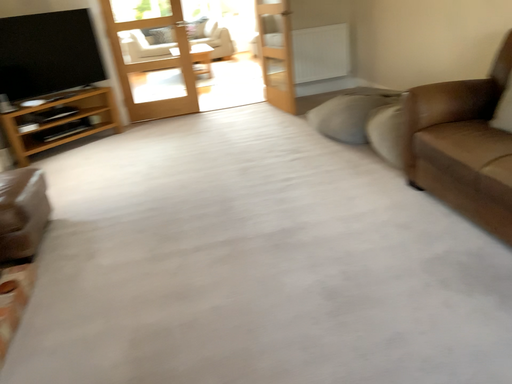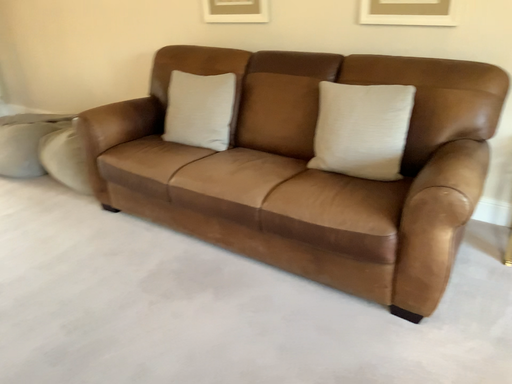
Question: How did the camera likely rotate when shooting the video?

Choices:
 (A) rotated downward
 (B) rotated upward

Answer: (B)